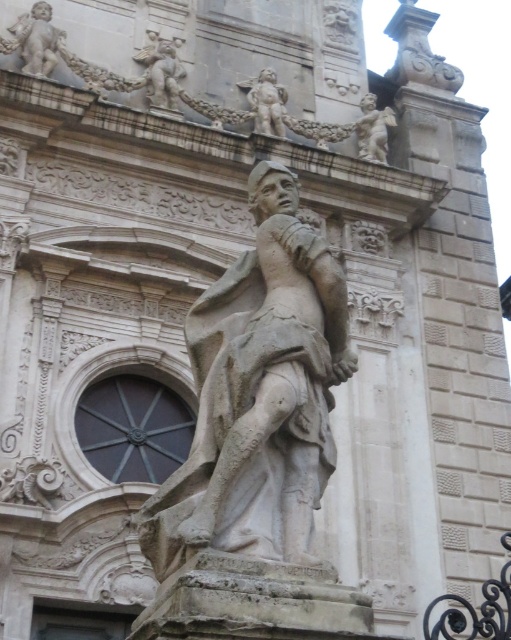
You are an art conservator assessing the space around the stone statue at center and the polished stone cherub at upper right. Based on their sizes, which object would require a wider protective barrier to prevent damage from accidental collisions?

The stone statue at center requires a wider protective barrier because its width is larger than the polished stone cherub at upper right.

Consider the image. You are an art student analyzing the composition of the sculpture. You notice a point marked at coordinates (35, 40). Which object in the scene does this point correspond to?

The point at coordinates (35, 40) corresponds to the smooth stone cherub at upper left.

You are an art conservator standing 15 meters away from the smooth stone cherub at upper left and the stone statue at upper center. You need to inspect both objects. Which one is closer to you?

The smooth stone cherub at upper left is 10.50 meters away from the stone statue at upper center. Since you are 15 meters away from both, neither is closer. However, if you are positioned such that the distance from you to the cherub plus the distance between the cherub and the statue equals 15 meters, then the stone statue at upper center would be 4.5 meters behind the cherub, making the cherub closer to you.